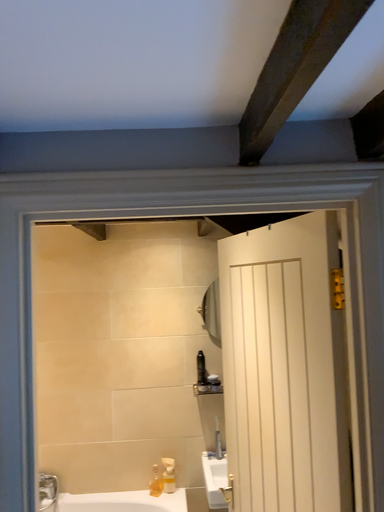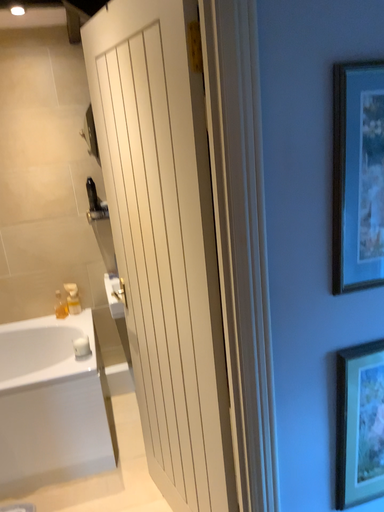
Question: Which way did the camera rotate in the video?

Choices:
 (A) rotated left
 (B) rotated right

Answer: (B)